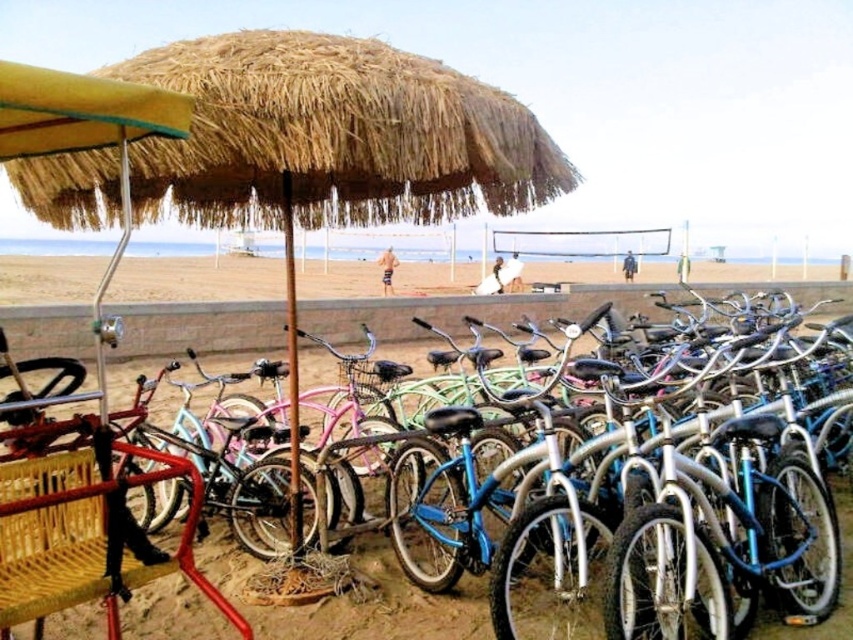
Question: Among these points, which one is farthest from the camera?

Choices:
 (A) pyautogui.click(x=254, y=132)
 (B) pyautogui.click(x=556, y=305)
 (C) pyautogui.click(x=668, y=282)

Answer: (C)

Question: Is straw at upper center to the left of beige sand at center from the viewer's perspective?

Choices:
 (A) no
 (B) yes

Answer: (A)

Question: Which object appears closest to the camera in this image?

Choices:
 (A) blue matte bicycle at center
 (B) beige sand at center

Answer: (A)

Question: Considering the relative positions of blue matte bicycle at center and beige sand at center in the image provided, where is blue matte bicycle at center located with respect to beige sand at center?

Choices:
 (A) below
 (B) above

Answer: (A)

Question: Is straw at upper center bigger than blue matte bicycle at center?

Choices:
 (A) no
 (B) yes

Answer: (A)

Question: Which of the following is the closest to the observer?

Choices:
 (A) beige sand at center
 (B) blue matte bicycle at center
 (C) straw at upper center

Answer: (C)